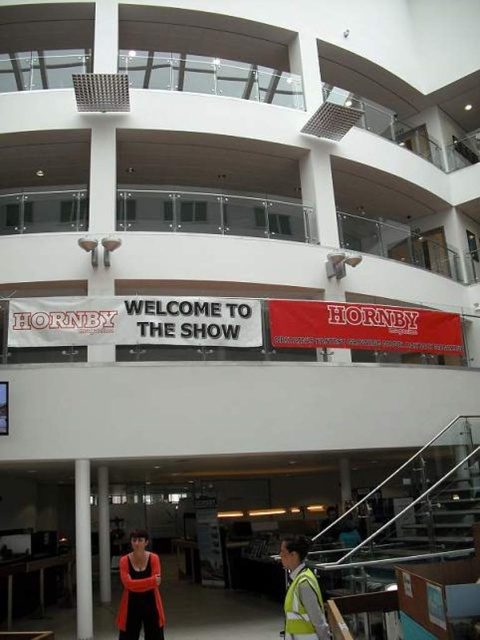
Is white glossy pillar at lower center thinner than white glossy pillar at center?

No.

Is point (84, 467) less distant than point (100, 557)?

Yes, point (84, 467) is in front of point (100, 557).

Is point (83, 556) closer to camera compared to point (100, 483)?

Yes, point (83, 556) is closer to viewer.

Identify the location of white glossy pillar at lower center. (83, 548).

Who is lower down, orange fabric construction vest at lower center or reflective yellow safety vest at lower center?

orange fabric construction vest at lower center is lower down.

Between point (117, 616) and point (288, 608), which one is positioned in front?

Point (288, 608)

Between point (131, 570) and point (288, 609), which one is positioned behind?

The point (131, 570) is behind.

This screenshot has height=640, width=480. Identify the location of orange fabric construction vest at lower center. (140, 592).

Does white glossy pillar at lower center have a greater width compared to reflective yellow safety vest at lower center?

Indeed, white glossy pillar at lower center has a greater width compared to reflective yellow safety vest at lower center.

Is point (86, 602) positioned behind point (307, 620)?

Yes, point (86, 602) is farther from viewer.

The image size is (480, 640). I want to click on white glossy pillar at lower center, so click(x=83, y=548).

You are a GUI agent. You are given a task and a screenshot of the screen. Output one action in this format:
    pyautogui.click(x=<x>, y=<y>)
    Task: Click on the white glossy pillar at lower center
    
    Given the screenshot: What is the action you would take?
    (83, 548)